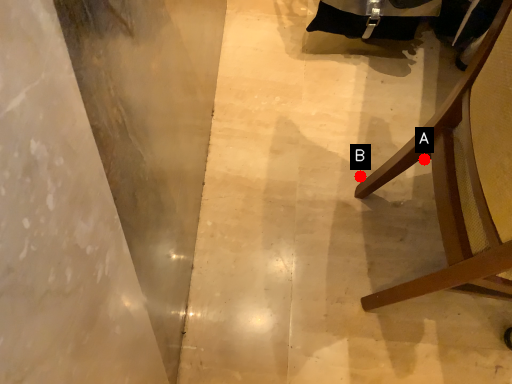
Question: Two points are circled on the image, labeled by A and B beside each circle. Which of the following is the farthest from the observer?

Choices:
 (A) A is further
 (B) B is further

Answer: (B)